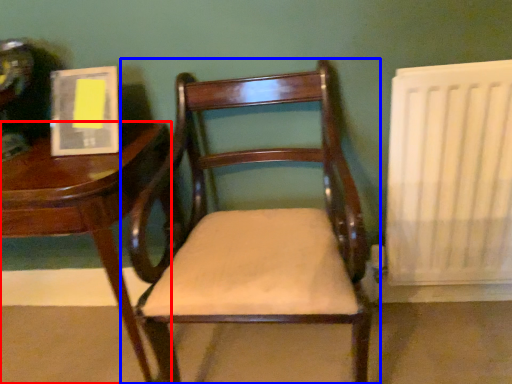
Question: Which object appears farthest to the camera in this image, table (highlighted by a red box) or chair (highlighted by a blue box)?

Choices:
 (A) table
 (B) chair

Answer: (A)